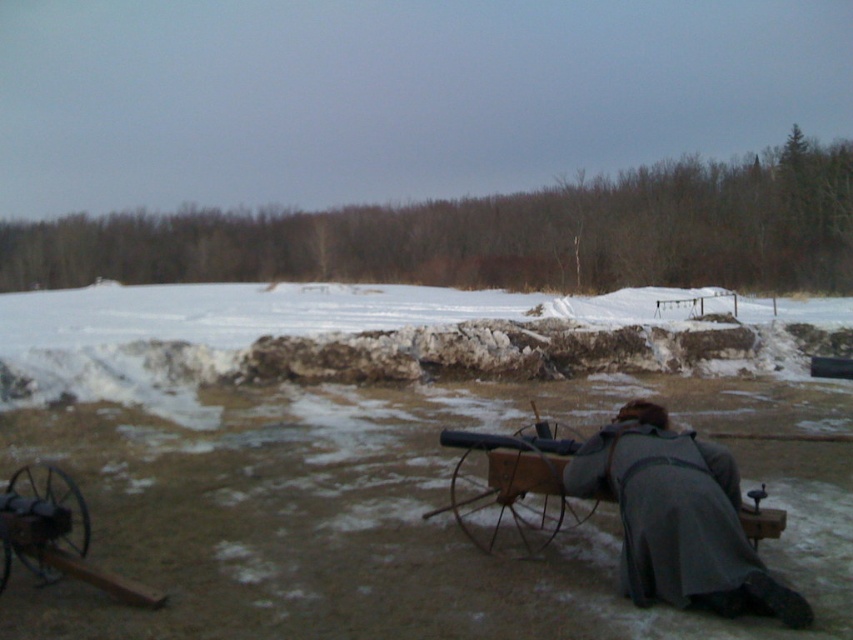
Question: Does wooden wagon at center appear on the left side of wooden cannon at lower left?

Choices:
 (A) yes
 (B) no

Answer: (B)

Question: Estimate the real-world distances between objects in this image. Which object is closer to the wooden cannon at lower left?

Choices:
 (A) gray wool coat at lower center
 (B) wooden wagon at center

Answer: (B)

Question: Based on their relative distances, which object is farther from the wooden cannon at lower left?

Choices:
 (A) wooden wagon at center
 (B) gray wool coat at lower center

Answer: (B)

Question: Can you confirm if gray wool coat at lower center is positioned above wooden wagon at center?

Choices:
 (A) yes
 (B) no

Answer: (A)

Question: Does wooden wagon at center appear on the left side of wooden cannon at lower left?

Choices:
 (A) no
 (B) yes

Answer: (A)

Question: Estimate the real-world distances between objects in this image. Which object is closer to the wooden cannon at lower left?

Choices:
 (A) wooden wagon at center
 (B) gray wool coat at lower center

Answer: (A)